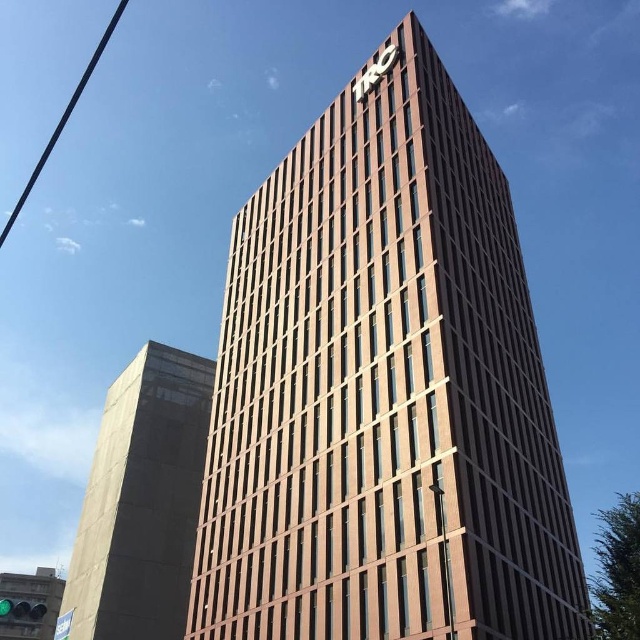
Based on the photo, you are a photographer planning to take a picture of the building. You want to ensure that the concrete tower at left is not blocking the view of the black wire at upper left. Is this possible?

The concrete tower at left is in front of the black wire at upper left, so it will block the view of the black wire at upper left. To avoid this, you need to adjust your position so the concrete tower at left is no longer in front of the black wire at upper left.

You are standing in a park across from the brown brick building at center. You want to take a photo of the building with your smartphone, which has a maximum zoom range of 10x. Considering the distance between you and the building, can you clearly capture the

The distance between you and the brown brick building at center is 93.15 feet. Since your smartphone has a maximum zoom range of 10x, you can clearly capture the

You are a city planner reviewing architectural plans. You need to determine if the brown brick building at center will block sunlight to the concrete tower at left during midday. Based on their sizes and positions, can you infer which building is taller?

The brown brick building at center is larger in size than concrete tower at left, but size does not necessarily indicate height. However, since the scene describes the brown brick building at center as having a tall, modern building with a rectangular shape and the concrete tower at left is not mentioned to be as tall, it is likely the brown brick building at center is taller. Therefore, it may block sunlight to the concrete tower at left.